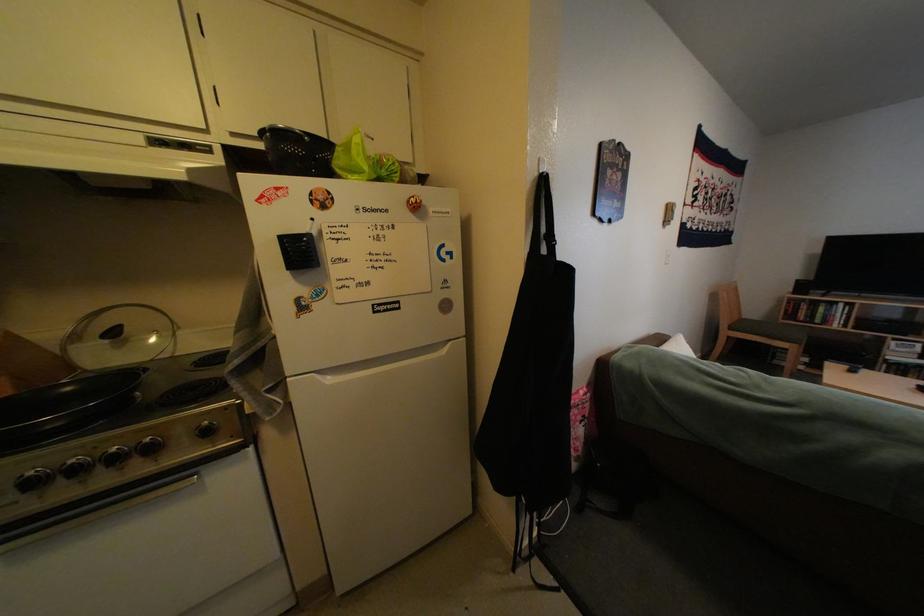
Find the location of a particular element. This screenshot has width=924, height=616. oven door handle is located at coordinates (98, 514).